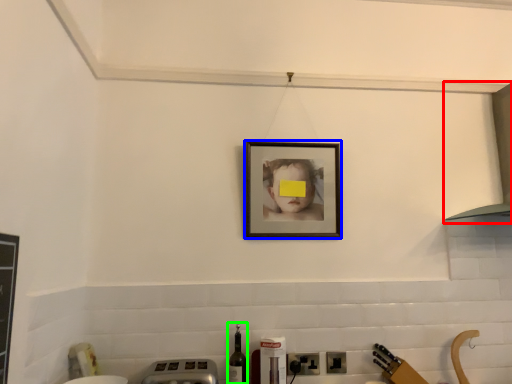
Question: Which is farther away from exhaust hood (highlighted by a red box)? picture frame (highlighted by a blue box) or bottle (highlighted by a green box)?

Choices:
 (A) picture frame
 (B) bottle

Answer: (B)